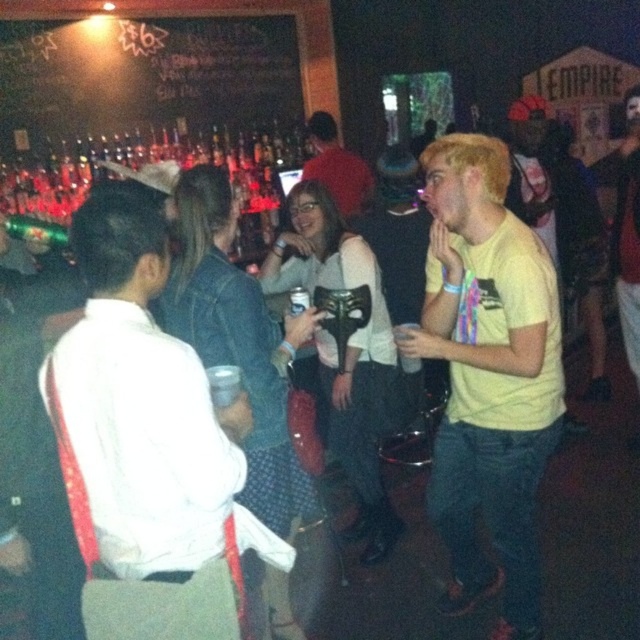
You are at the bar and want to move from your current position to the exit located near the point labeled as point (x=316, y=166). There is an obstacle at point labeled as point (x=204, y=557). Will you have to go around the obstacle to reach the exit?

Yes, you will have to go around the obstacle at point (x=204, y=557) because it is in front of point (x=316, y=166), which is the direction of the exit.

Based on the photo, you are at a bar and want to order a drink. You see the white matte shirt at left and the matte red shirt at center. Which one is closer to the bartender?

The white matte shirt at left is located below the matte red shirt at center, so it is closer to the bartender.